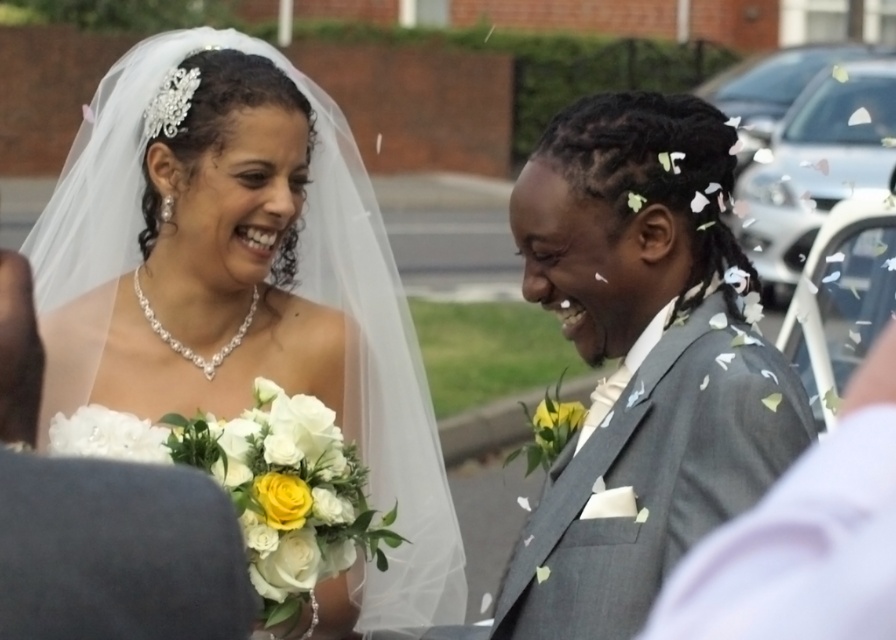
Can you confirm if white satin veil at upper left is smaller than gray textured suit at right?

No.

Is white satin veil at upper left taller than gray textured suit at right?

Correct, white satin veil at upper left is much taller as gray textured suit at right.

Is point (255, 228) positioned before point (586, 99)?

That is False.

The height and width of the screenshot is (640, 896). I want to click on white satin veil at upper left, so pyautogui.click(x=244, y=285).